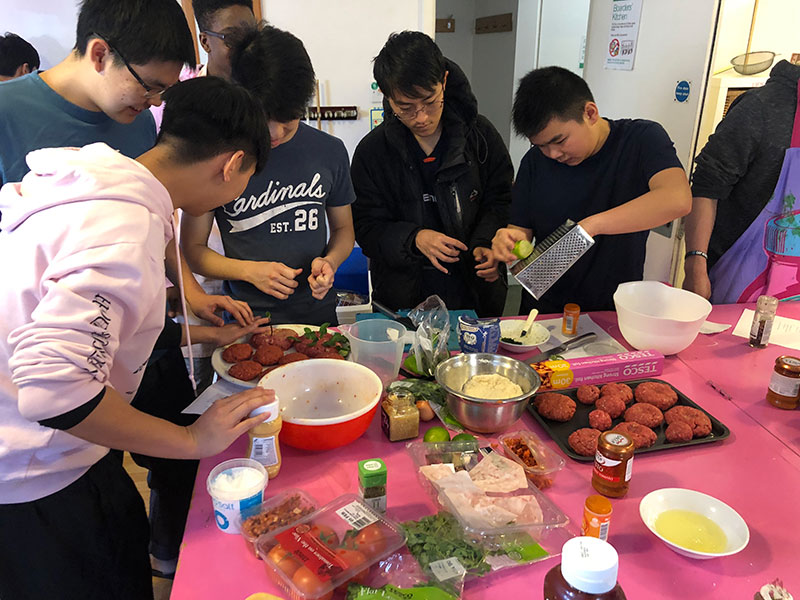
This screenshot has width=800, height=600. What are the coordinates of `white wall` in the screenshot? It's located at (338, 45).